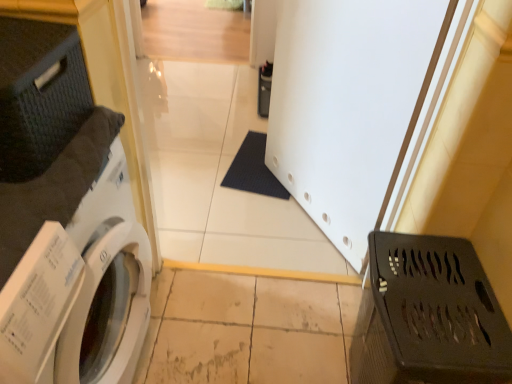
Measure the distance between black plastic laundry basket at lower right and camera.

The depth of black plastic laundry basket at lower right is 33.27 inches.

Identify the location of white matte screen door at center. (349, 106).

From the image's perspective, is black plastic laundry basket at lower right beneath white matte screen door at center?

Correct, black plastic laundry basket at lower right appears lower than white matte screen door at center in the image.

From the picture: Between black plastic laundry basket at lower right and white matte screen door at center, which one has more height?

With more height is white matte screen door at center.

Which is in front, point (496, 303) or point (387, 3)?

Positioned in front is point (496, 303).

Consider the image. Considering the relative sizes of black plastic laundry basket at lower right and white matte screen door at center in the image provided, is black plastic laundry basket at lower right wider than white matte screen door at center?

Correct, the width of black plastic laundry basket at lower right exceeds that of white matte screen door at center.

Does white glossy washing machine at left have a greater width compared to white matte screen door at center?

Indeed, white glossy washing machine at left has a greater width compared to white matte screen door at center.

Between white glossy washing machine at left and white matte screen door at center, which one has larger size?

Bigger between the two is white glossy washing machine at left.

Choose the correct answer: Is white glossy washing machine at left inside white matte screen door at center or outside it?

white glossy washing machine at left is outside white matte screen door at center.

Is white glossy washing machine at left at the right side of white matte screen door at center?

Incorrect, white glossy washing machine at left is not on the right side of white matte screen door at center.

Can you confirm if white glossy washing machine at left is shorter than black plastic laundry basket at lower right?

In fact, white glossy washing machine at left may be taller than black plastic laundry basket at lower right.

Can you confirm if white glossy washing machine at left is wider than black plastic laundry basket at lower right?

Yes.

Between white glossy washing machine at left and black plastic laundry basket at lower right, which one has larger size?

white glossy washing machine at left.

Identify the location of washing machine above the black plastic laundry basket at lower right (from the image's perspective). (81, 291).

Is white glossy washing machine at left inside white matte screen door at center?

No, white matte screen door at center does not contain white glossy washing machine at left.

Is white matte screen door at center behind white glossy washing machine at left?

Yes, white matte screen door at center is behind white glossy washing machine at left.

In the scene shown: From a real-world perspective, is white matte screen door at center positioned under white glossy washing machine at left based on gravity?

No, from a real-world perspective, white matte screen door at center is not below white glossy washing machine at left.

Consider the image. From the image's perspective, is white matte screen door at center positioned above or below black plastic laundry basket at lower right?

Clearly, from the image's perspective, white matte screen door at center is above black plastic laundry basket at lower right.

Locate an element on the screen. screen door behind the black plastic laundry basket at lower right is located at coordinates (349, 106).

Is white matte screen door at center positioned beyond the bounds of black plastic laundry basket at lower right?

Yes, white matte screen door at center is located beyond the bounds of black plastic laundry basket at lower right.

From the image's perspective, is black plastic laundry basket at lower right located above white glossy washing machine at left?

No.

Considering the points (450, 297) and (100, 342), which point is in front, point (450, 297) or point (100, 342)?

The point (450, 297) is closer to the camera.

Between black plastic laundry basket at lower right and white glossy washing machine at left, which one has less height?

With less height is black plastic laundry basket at lower right.

In order to click on screen door on the left side of black plastic laundry basket at lower right in this screenshot , I will do `click(349, 106)`.

There is a white glossy washing machine at left. Where is `screen door above it (from a real-world perspective)`? screen door above it (from a real-world perspective) is located at coordinates (349, 106).

Looking at the image, which one is located further to black plastic laundry basket at lower right, white matte screen door at center or white glossy washing machine at left?

Among the two, white glossy washing machine at left is located further to black plastic laundry basket at lower right.

From the image, which object appears to be nearer to white matte screen door at center, black plastic laundry basket at lower right or white glossy washing machine at left?

The object closer to white matte screen door at center is black plastic laundry basket at lower right.

When comparing their distances from white matte screen door at center, does white glossy washing machine at left or black plastic laundry basket at lower right seem closer?

black plastic laundry basket at lower right is positioned closer to the anchor white matte screen door at center.

Considering their positions, is white matte screen door at center positioned closer to white glossy washing machine at left than black plastic laundry basket at lower right?

black plastic laundry basket at lower right is closer to white glossy washing machine at left.

Which object lies further to the anchor point black plastic laundry basket at lower right, white glossy washing machine at left or white matte screen door at center?

Among the two, white glossy washing machine at left is located further to black plastic laundry basket at lower right.

Looking at the image, which one is located further to white glossy washing machine at left, black plastic laundry basket at lower right or white matte screen door at center?

Based on the image, white matte screen door at center appears to be further to white glossy washing machine at left.

Where is `screen door between white glossy washing machine at left and black plastic laundry basket at lower right`? screen door between white glossy washing machine at left and black plastic laundry basket at lower right is located at coordinates (349, 106).